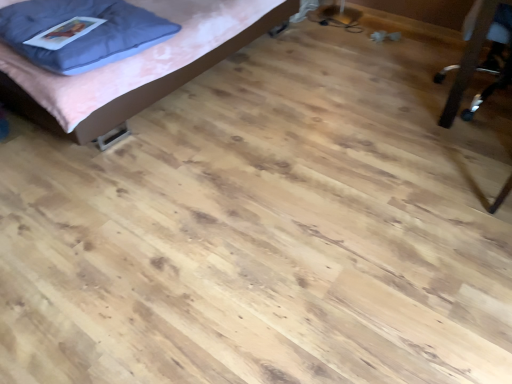
Locate an element on the screen. vacant position to the left of metallic silver chair at right is located at coordinates (381, 102).